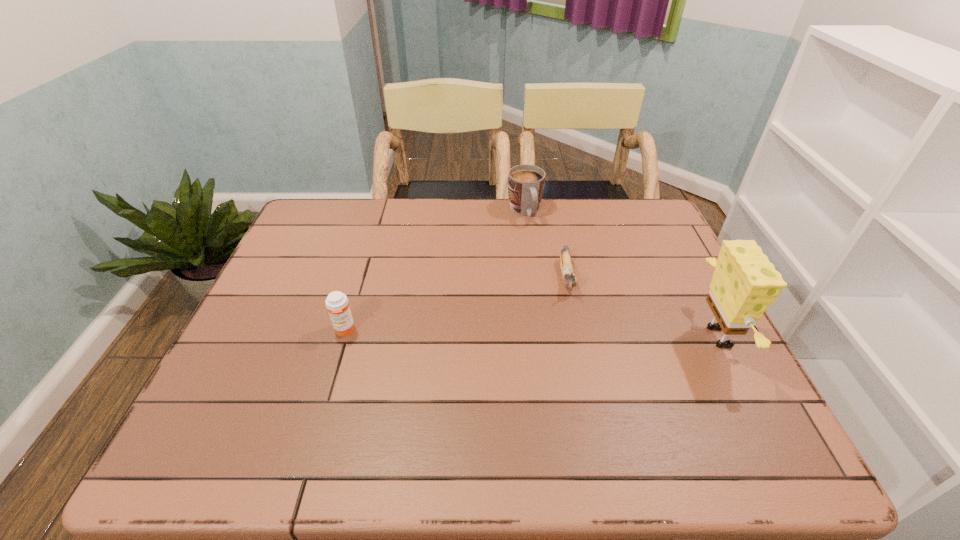
The image size is (960, 540). I want to click on blank space at the left edge, so click(x=313, y=287).

The width and height of the screenshot is (960, 540). What are the coordinates of `vacant space at the right edge of the desktop` in the screenshot? It's located at (686, 354).

Identify the location of free space at the far left corner of the desktop. (352, 216).

Where is `free point at the far right corner`? free point at the far right corner is located at coordinates (626, 233).

Locate an element on the screen. This screenshot has width=960, height=540. free space between the shortest object and the third object from right to left is located at coordinates (546, 245).

Where is `free space between the farthest object and the banana`? The height and width of the screenshot is (540, 960). free space between the farthest object and the banana is located at coordinates pyautogui.click(x=546, y=245).

Identify the location of vacant region between the leftmost object and the second object from left to right. The image size is (960, 540). (435, 271).

Identify the location of vacant area that lies between the sponge and the leftmost object. (534, 334).

Identify the location of free area in between the shortest object and the leftmost object. This screenshot has width=960, height=540. tap(456, 303).

Locate an element on the screen. The height and width of the screenshot is (540, 960). free space between the second object from right to left and the tallest object is located at coordinates (644, 307).